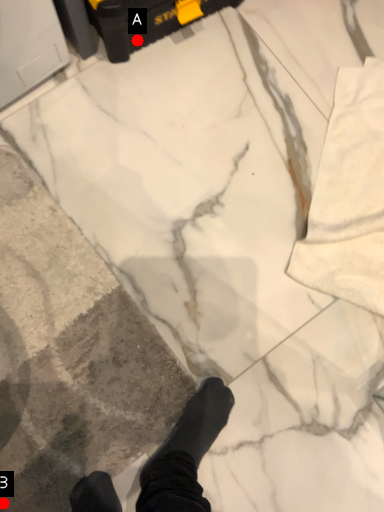
Question: Two points are circled on the image, labeled by A and B beside each circle. Which point is closer to the camera taking this photo?

Choices:
 (A) A is closer
 (B) B is closer

Answer: (B)